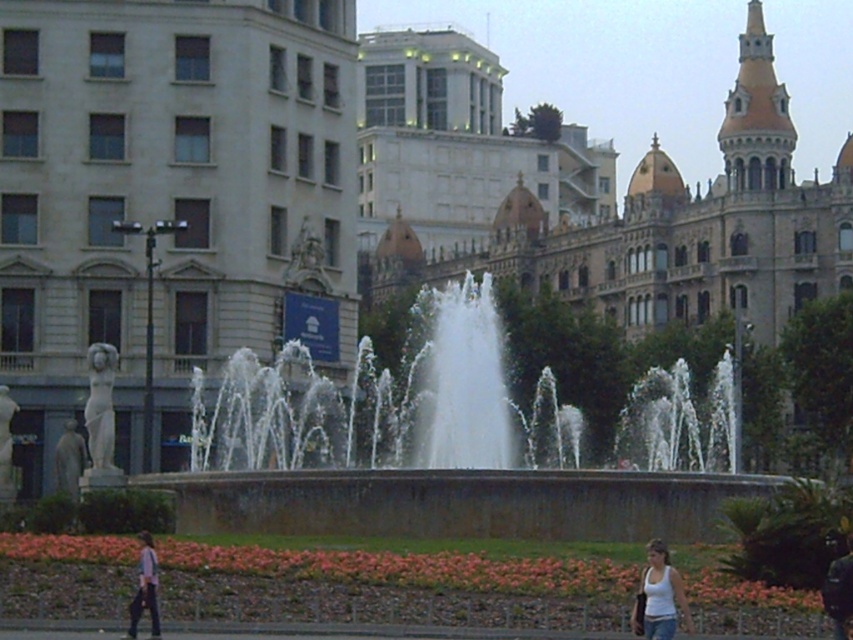
Who is lower down, white marble statue at left or smooth gray statue at left?

Positioned lower is smooth gray statue at left.

Who is higher up, white marble statue at left or smooth gray statue at left?

white marble statue at left is above.

Describe the element at coordinates (167, 198) in the screenshot. I see `white marble statue at left` at that location.

You are a GUI agent. You are given a task and a screenshot of the screen. Output one action in this format:
    pyautogui.click(x=<x>, y=<y>)
    Task: Click on the white marble statue at left
    
    Given the screenshot: What is the action you would take?
    pyautogui.click(x=167, y=198)

Is golden stone palace at center wider than dark brown leather jacket at lower right?

Yes, golden stone palace at center is wider than dark brown leather jacket at lower right.

Between golden stone palace at center and dark brown leather jacket at lower right, which one is positioned higher?

golden stone palace at center is higher up.

Measure the distance between golden stone palace at center and camera.

The distance of golden stone palace at center from camera is 101.73 meters.

Where is `golden stone palace at center`? golden stone palace at center is located at coordinates (610, 205).

Can you confirm if white marble statue at left is thinner than golden stone palace at center?

Yes.

Is white marble statue at left positioned in front of golden stone palace at center?

Yes, it is in front of golden stone palace at center.

Based on the photo, who is more forward, (219, 241) or (664, 243)?

Positioned in front is point (219, 241).

Image resolution: width=853 pixels, height=640 pixels. Find the location of `white marble statue at left`. white marble statue at left is located at coordinates (167, 198).